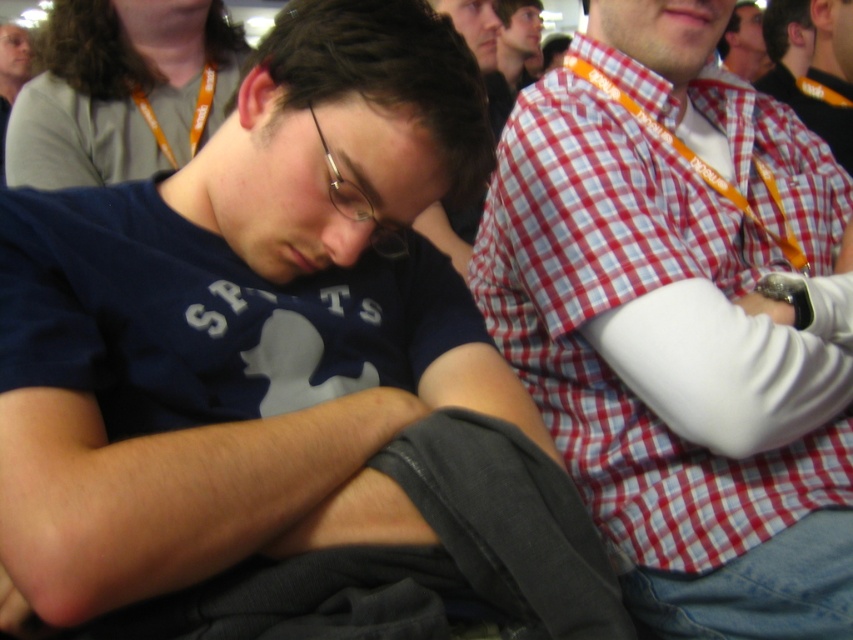
You are a photographer trying to capture a candid shot of the matte blue shirt at center and the matte black glasses at upper center. Which object should you focus on first if you want to ensure both are in focus without adjusting your camera settings?

The matte black glasses at upper center should be focused on first because it is closer to the camera than the matte blue shirt at center, so focusing on the closer object ensures both will be in focus with proper depth of field.

What are the coordinates of the matte blue shirt at center?

The coordinates of the matte blue shirt at center are point (x=283, y=371).